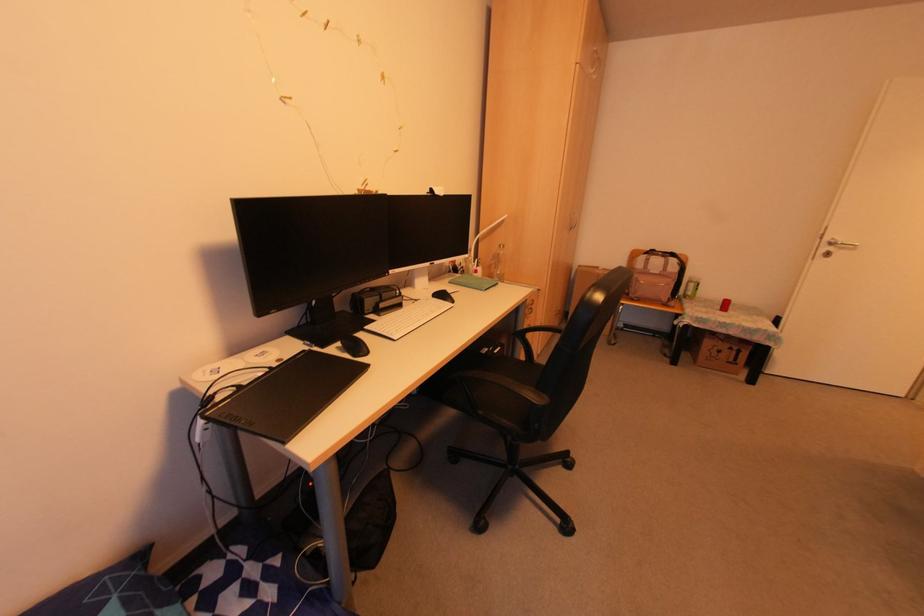
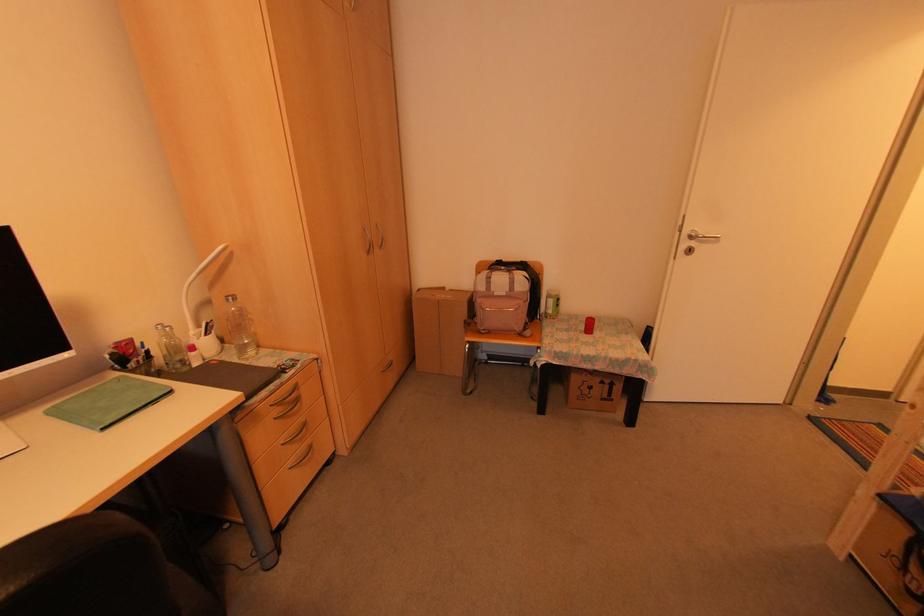
Find the pixel in the second image that matches (x=628, y=294) in the first image.

(477, 326)